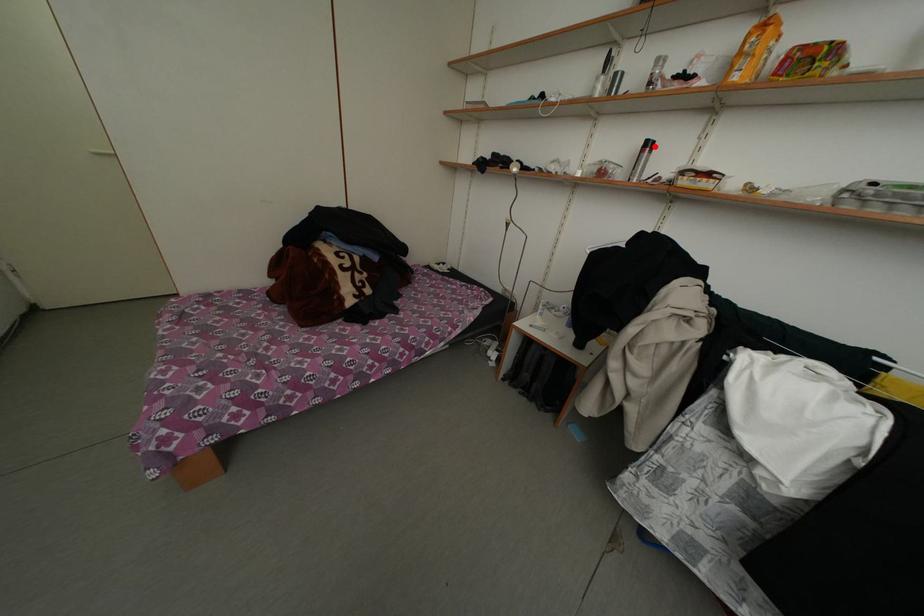
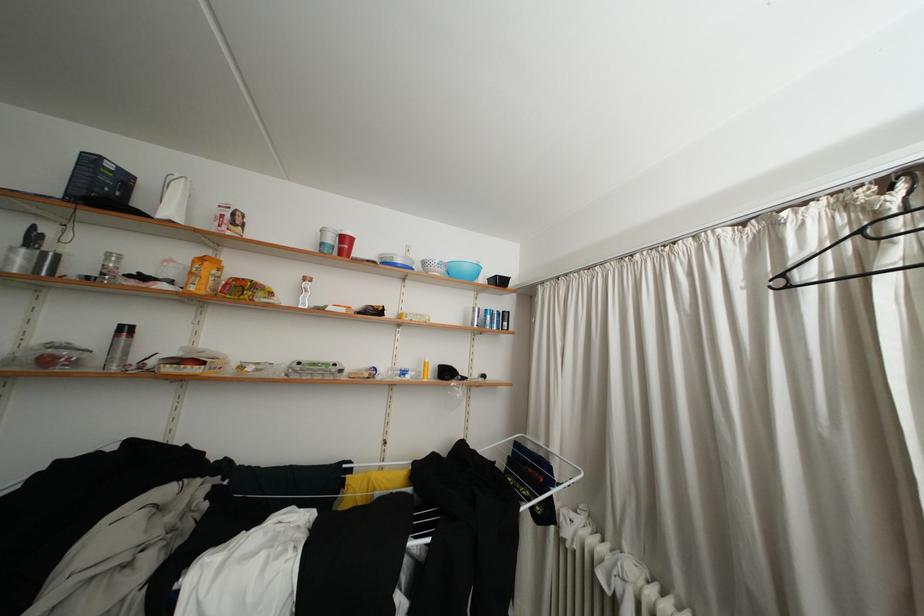
The point at the highlighted location is marked in the first image. Where is the corresponding point in the second image?

(129, 331)